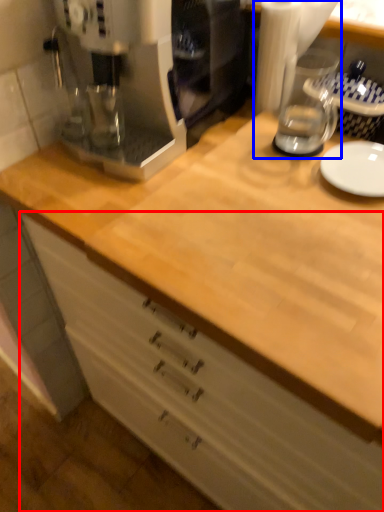
Question: Among these objects, which one is farthest to the camera, cabinetry (highlighted by a red box) or blender (highlighted by a blue box)?

Choices:
 (A) cabinetry
 (B) blender

Answer: (B)